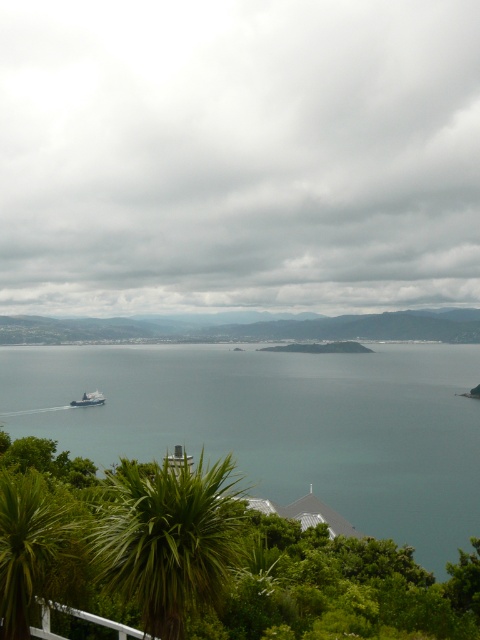
From the picture: Can you confirm if green leafy palm tree at lower left is shorter than blue metallic cruise ship at lower left?

Indeed, green leafy palm tree at lower left has a lesser height compared to blue metallic cruise ship at lower left.

Which of these two, green leafy palm tree at lower left or blue metallic cruise ship at lower left, stands taller?

With more height is blue metallic cruise ship at lower left.

Where is `green leafy palm tree at lower left`? The height and width of the screenshot is (640, 480). green leafy palm tree at lower left is located at coordinates (27, 545).

Can you confirm if green leafy palm tree at lower center is positioned to the left of blue metallic cruise ship at lower left?

Incorrect, green leafy palm tree at lower center is not on the left side of blue metallic cruise ship at lower left.

Does green leafy palm tree at lower center appear under blue metallic cruise ship at lower left?

No.

Measure the distance between point (x=151, y=480) and camera.

They are 7.90 meters apart.

Locate an element on the screen. This screenshot has width=480, height=640. green leafy palm tree at lower center is located at coordinates (168, 538).

Is blue water at center to the left of blue metallic cruise ship at lower left from the viewer's perspective?

In fact, blue water at center is to the right of blue metallic cruise ship at lower left.

Can you confirm if blue water at center is positioned above blue metallic cruise ship at lower left?

Yes, blue water at center is above blue metallic cruise ship at lower left.

This screenshot has height=640, width=480. I want to click on blue water at center, so [x=278, y=424].